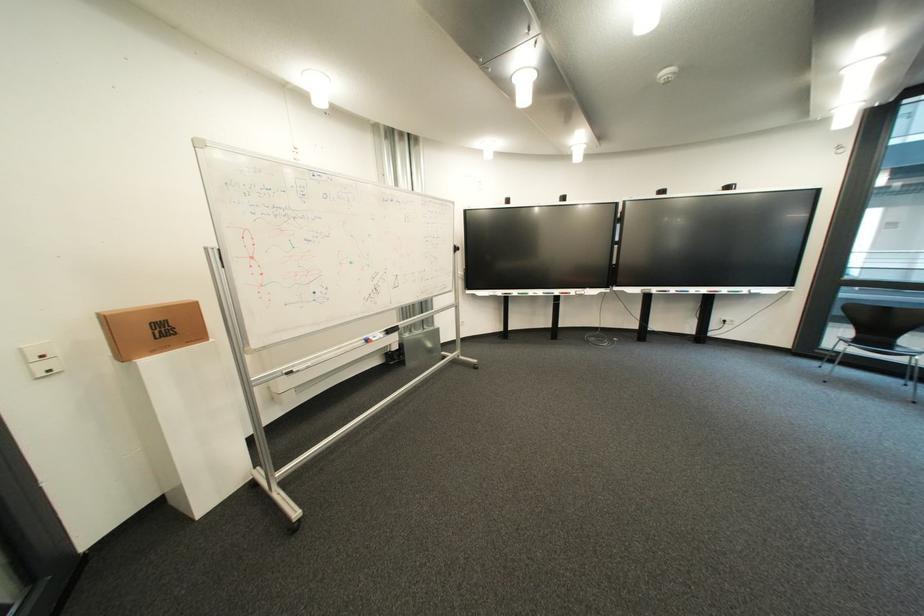
Image resolution: width=924 pixels, height=616 pixels. What do you see at coordinates (295, 525) in the screenshot?
I see `the whiteboard stand wheel` at bounding box center [295, 525].